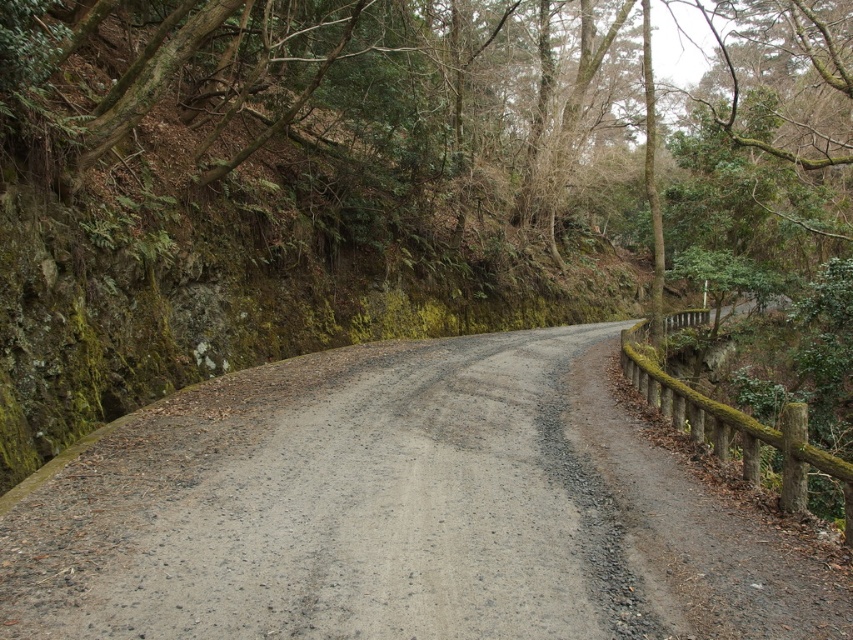
Can you confirm if green mossy rock at upper left is positioned above gray gravel road at center?

Indeed, green mossy rock at upper left is positioned over gray gravel road at center.

Between point (195, 189) and point (543, 433), which one is positioned behind?

Positioned behind is point (195, 189).

Where is `green mossy rock at upper left`? The height and width of the screenshot is (640, 853). green mossy rock at upper left is located at coordinates (410, 148).